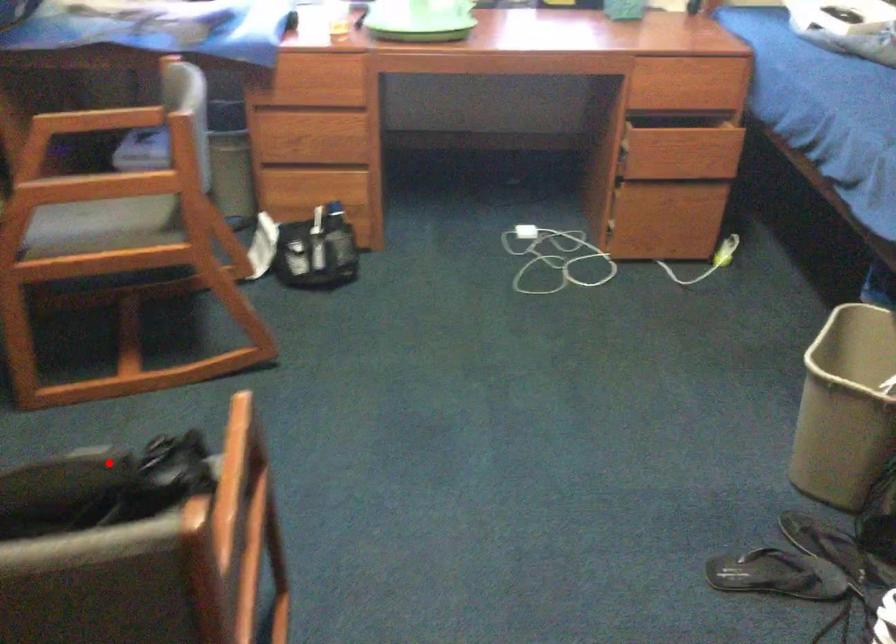
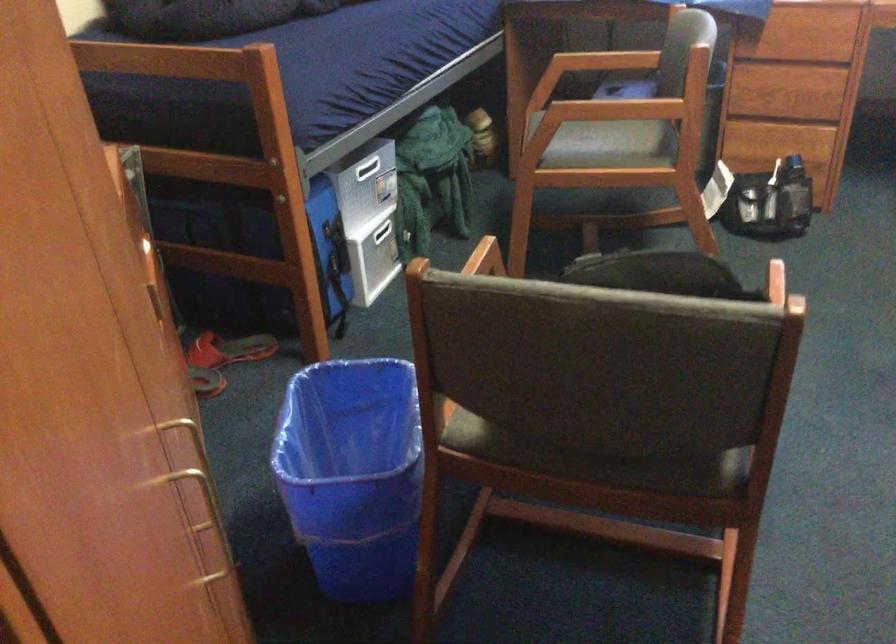
Where in the second image is the point corresponding to the highlighted location from the first image?

(659, 272)